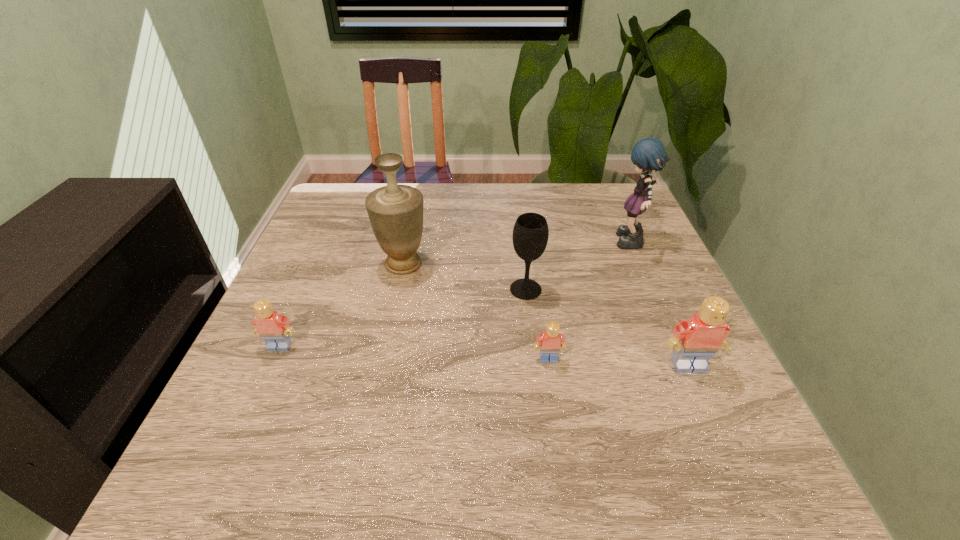
This screenshot has height=540, width=960. I want to click on unoccupied area between the leftmost Lego and the shortest object, so click(414, 353).

Locate an element on the screen. Image resolution: width=960 pixels, height=540 pixels. empty space between the shortest Lego and the rightmost Lego is located at coordinates (618, 362).

Identify the location of empty location between the shortest object and the fifth object from right to left. (476, 312).

Point out which object is positioned as the nearest to the urn. Please provide its 2D coordinates. Your answer should be formatted as a tuple, i.e. [(x, y)], where the tuple contains the x and y coordinates of a point satisfying the conditions above.

[(530, 235)]

Where is `object that stands as the fifth closest to the fifth object from right to left`? object that stands as the fifth closest to the fifth object from right to left is located at coordinates (696, 340).

Locate an element on the screen. The height and width of the screenshot is (540, 960). Lego that is the third closest one to the rag doll is located at coordinates (274, 329).

Locate which Lego ranks third in proximity to the urn. Please provide its 2D coordinates. Your answer should be formatted as a tuple, i.e. [(x, y)], where the tuple contains the x and y coordinates of a point satisfying the conditions above.

[(696, 340)]

Locate an element on the screen. free space that satisfies the following two spatial constraints: 1. on the front-facing side of the rag doll; 2. on the front side of the wineglass is located at coordinates (650, 289).

Identify the location of vacant region that satisfies the following two spatial constraints: 1. on the front-facing side of the rag doll; 2. on the front side of the urn. (639, 264).